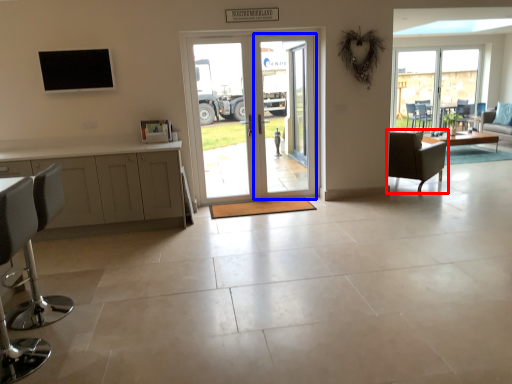
Question: Which point is further to the camera, chair (highlighted by a red box) or screen door (highlighted by a blue box)?

Choices:
 (A) chair
 (B) screen door

Answer: (A)